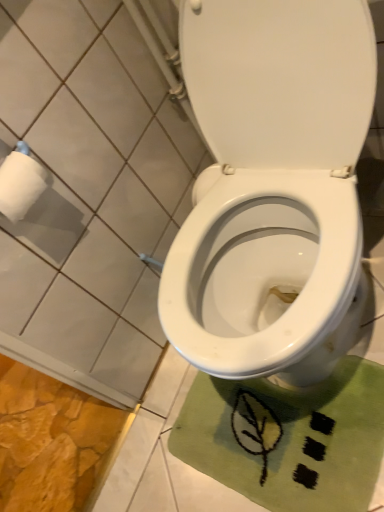
You are a GUI agent. You are given a task and a screenshot of the screen. Output one action in this format:
    pyautogui.click(x=<x>, y=<y>)
    Task: Click on the green fabric bath mat at lower right
    This screenshot has width=384, height=512.
    Given the screenshot: What is the action you would take?
    pyautogui.click(x=288, y=438)

This screenshot has height=512, width=384. Describe the element at coordinates (288, 438) in the screenshot. I see `green fabric bath mat at lower right` at that location.

The image size is (384, 512). I want to click on white matte toilet paper at upper left, so click(20, 185).

This screenshot has height=512, width=384. What do you see at coordinates (20, 185) in the screenshot?
I see `white matte toilet paper at upper left` at bounding box center [20, 185].

Where is `green fabric bath mat at lower right`? Image resolution: width=384 pixels, height=512 pixels. green fabric bath mat at lower right is located at coordinates (288, 438).

Looking at this image, between green fabric bath mat at lower right and white matte toilet paper at upper left, which one appears on the right side from the viewer's perspective?

green fabric bath mat at lower right.

Who is more distant, green fabric bath mat at lower right or white matte toilet paper at upper left?

green fabric bath mat at lower right is behind.

Is point (283, 405) behind point (24, 191)?

Yes, point (283, 405) is behind point (24, 191).

Looking at this image, from the image's perspective, would you say green fabric bath mat at lower right is shown under white matte toilet paper at upper left?

Correct, green fabric bath mat at lower right appears lower than white matte toilet paper at upper left in the image.

From a real-world perspective, which object stands above the other?

white matte toilet paper at upper left is physically above.

Considering the relative sizes of green fabric bath mat at lower right and white matte toilet paper at upper left in the image provided, is green fabric bath mat at lower right thinner than white matte toilet paper at upper left?

In fact, green fabric bath mat at lower right might be wider than white matte toilet paper at upper left.

From the picture: Between green fabric bath mat at lower right and white matte toilet paper at upper left, which one has less height?

green fabric bath mat at lower right is shorter.

Considering the relative sizes of green fabric bath mat at lower right and white matte toilet paper at upper left in the image provided, is green fabric bath mat at lower right smaller than white matte toilet paper at upper left?

No.

Is green fabric bath mat at lower right not inside white matte toilet paper at upper left?

Absolutely, green fabric bath mat at lower right is external to white matte toilet paper at upper left.

Is green fabric bath mat at lower right next to white matte toilet paper at upper left?

green fabric bath mat at lower right is not next to white matte toilet paper at upper left, and they're not touching.

Is white matte toilet paper at upper left at the back of green fabric bath mat at lower right?

No.

How different are the orientations of green fabric bath mat at lower right and white matte toilet paper at upper left in degrees?

green fabric bath mat at lower right and white matte toilet paper at upper left are facing 92.8 degrees away from each other.

Image resolution: width=384 pixels, height=512 pixels. What are the coordinates of `bath mat below the white matte toilet paper at upper left (from the image's perspective)` in the screenshot? It's located at (288, 438).

Looking at this image, does white matte toilet paper at upper left appear on the right side of green fabric bath mat at lower right?

Incorrect, white matte toilet paper at upper left is not on the right side of green fabric bath mat at lower right.

Which is in front, white matte toilet paper at upper left or green fabric bath mat at lower right?

white matte toilet paper at upper left.

Is point (37, 184) closer or farther from the camera than point (235, 420)?

Point (37, 184) is positioned closer to the camera compared to point (235, 420).

From the image's perspective, does white matte toilet paper at upper left appear lower than green fabric bath mat at lower right?

No.

From a real-world perspective, which object rests below the other?

In real-world perspective, green fabric bath mat at lower right is lower.

Between white matte toilet paper at upper left and green fabric bath mat at lower right, which one has smaller width?

Thinner between the two is white matte toilet paper at upper left.

Considering the sizes of objects white matte toilet paper at upper left and green fabric bath mat at lower right in the image provided, who is taller, white matte toilet paper at upper left or green fabric bath mat at lower right?

Standing taller between the two is white matte toilet paper at upper left.

In the scene shown: Which of these two, white matte toilet paper at upper left or green fabric bath mat at lower right, is bigger?

green fabric bath mat at lower right.

Would you say green fabric bath mat at lower right is part of white matte toilet paper at upper left's contents?

No.

Is the surface of white matte toilet paper at upper left in direct contact with green fabric bath mat at lower right?

white matte toilet paper at upper left and green fabric bath mat at lower right are not in contact.

In the scene shown: Could you tell me if white matte toilet paper at upper left is facing green fabric bath mat at lower right?

No, white matte toilet paper at upper left is not turned towards green fabric bath mat at lower right.

Based on the photo, how different are the orientations of white matte toilet paper at upper left and green fabric bath mat at lower right in degrees?

The angle between the facing direction of white matte toilet paper at upper left and the facing direction of green fabric bath mat at lower right is 92.8 degrees.

Identify the location of toilet paper in front of the green fabric bath mat at lower right. (20, 185).

Locate an element on the screen. bath mat behind the white matte toilet paper at upper left is located at coordinates (288, 438).

You are a GUI agent. You are given a task and a screenshot of the screen. Output one action in this format:
    pyautogui.click(x=<x>, y=<y>)
    Task: Click on the toilet paper on the left of green fabric bath mat at lower right
    
    Given the screenshot: What is the action you would take?
    pyautogui.click(x=20, y=185)